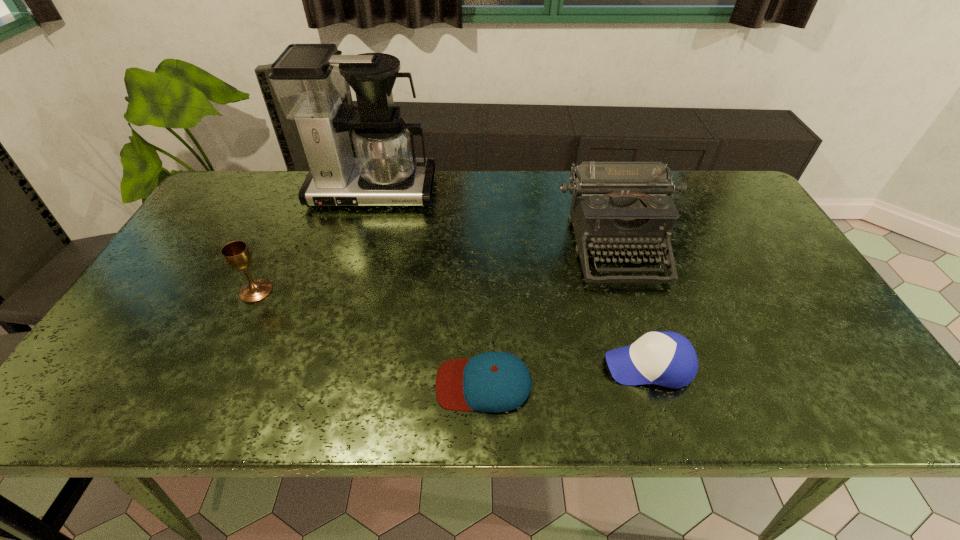
This screenshot has height=540, width=960. Find the location of `blank space at the left edge of the desktop`. blank space at the left edge of the desktop is located at coordinates (194, 286).

This screenshot has height=540, width=960. In the image, there is a desktop. In order to click on free space at the right edge in this screenshot , I will do `click(797, 325)`.

In order to click on vacant space at the far left corner in this screenshot , I will do `click(245, 176)`.

The height and width of the screenshot is (540, 960). What are the coordinates of `free region at the far right corner` in the screenshot? It's located at (705, 174).

I want to click on free space between the third object from left to right and the typewriter, so click(x=550, y=315).

Find the location of a particular element. The width and height of the screenshot is (960, 540). vacant space in between the coffee maker and the shortest object is located at coordinates (428, 288).

Image resolution: width=960 pixels, height=540 pixels. In order to click on vacant space in between the coffee maker and the typewriter in this screenshot , I will do `click(494, 219)`.

Locate an element on the screen. The width and height of the screenshot is (960, 540). vacant space that is in between the third object from right to left and the second tallest object is located at coordinates pos(550,315).

This screenshot has width=960, height=540. Identify the location of empty location between the fourth tallest object and the third object from right to left. (566, 375).

Identify the location of empty space between the third object from left to right and the chalice. (370, 338).